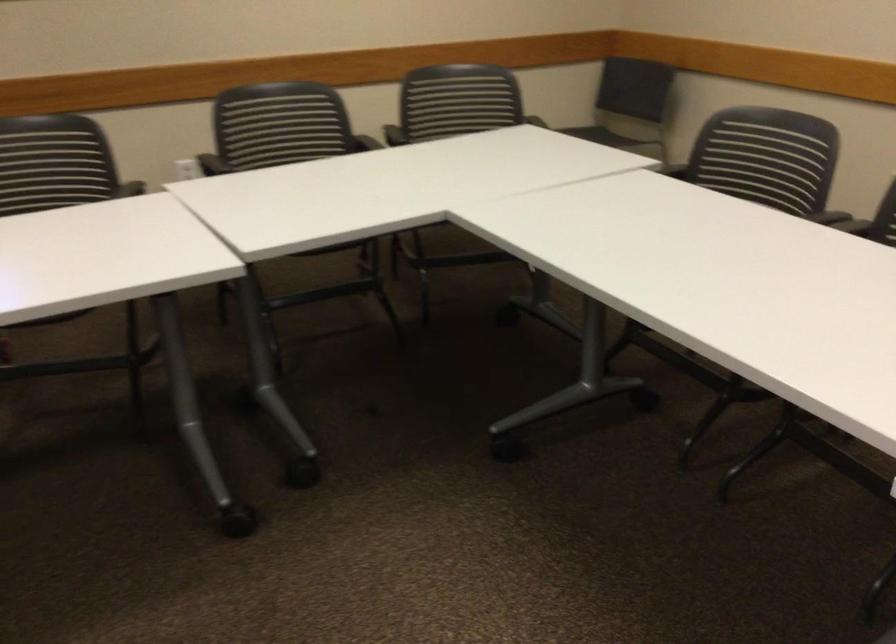
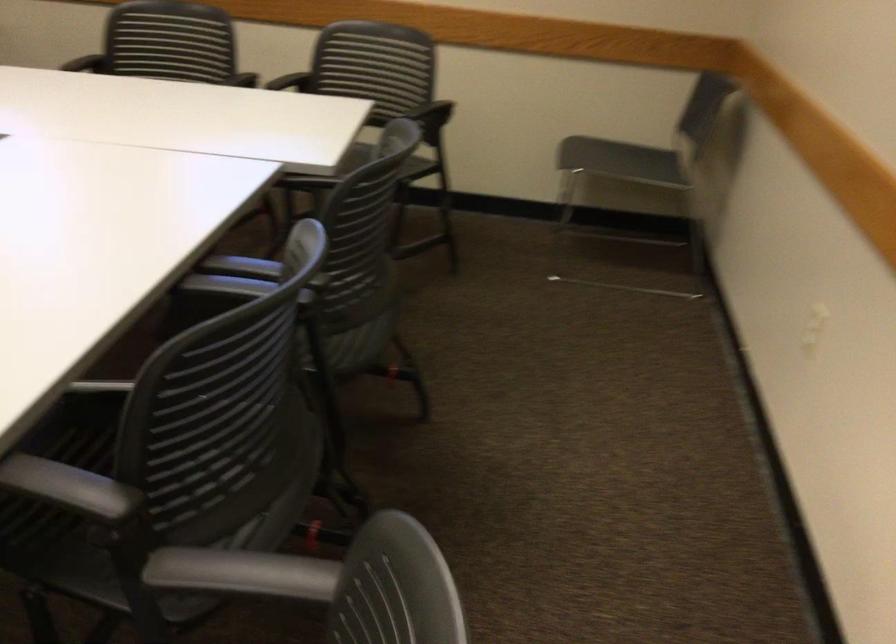
Find the pixel in the second image that matches (x=247, y=135) in the first image.

(168, 41)